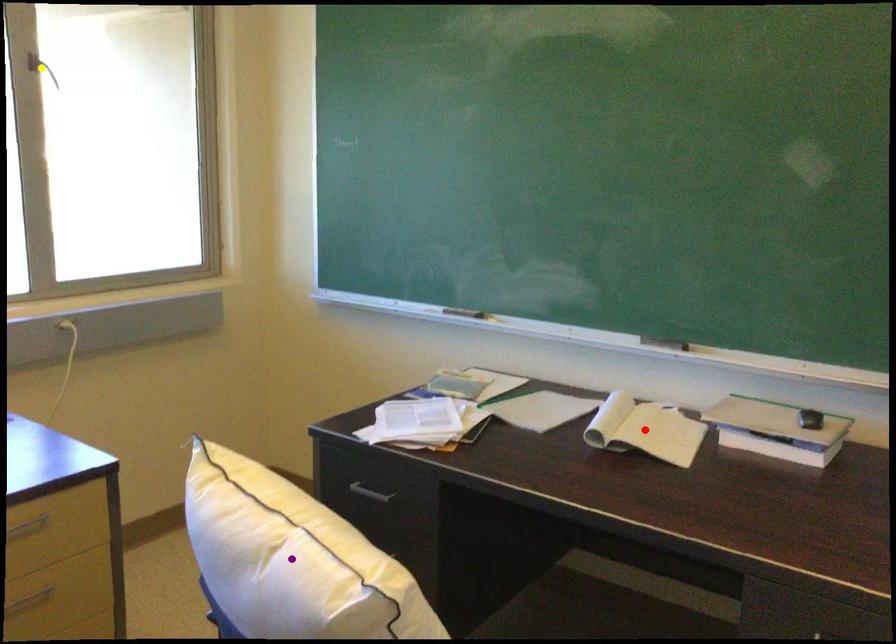
Order these from nearest to farthest:
purple point | yellow point | red point

purple point → red point → yellow point